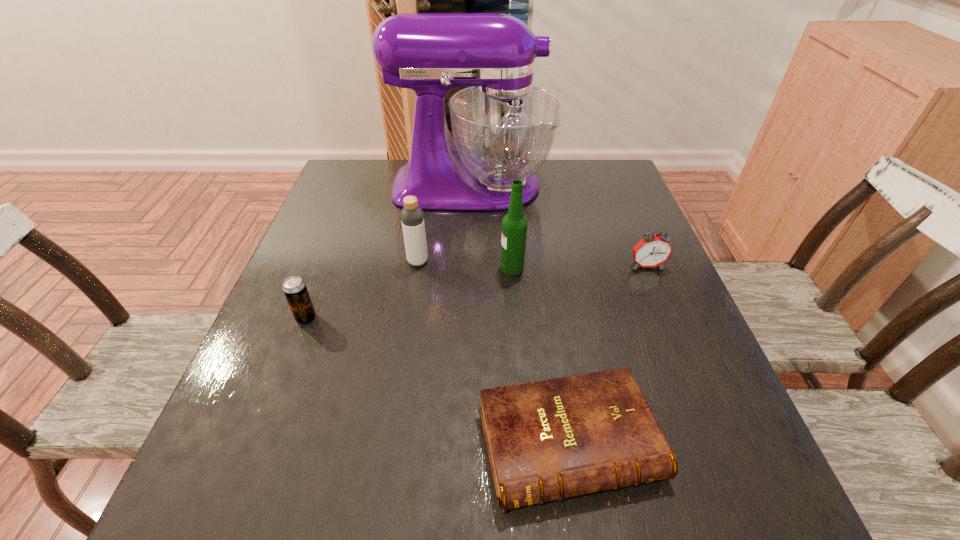
The width and height of the screenshot is (960, 540). Identify the location of vacant space that satisfies the following two spatial constraints: 1. at the bowl opening of the mixer; 2. on the left side of the shortest object. (466, 443).

The image size is (960, 540). In order to click on vacant space that satisfies the following two spatial constraints: 1. at the bowl opening of the shortest object; 2. on the left side of the farthest object in this screenshot , I will do `click(466, 443)`.

Where is `free spot that satisfies the following two spatial constraints: 1. on the front side of the shortest object; 2. on the left side of the third tallest object`? free spot that satisfies the following two spatial constraints: 1. on the front side of the shortest object; 2. on the left side of the third tallest object is located at coordinates (390, 443).

Where is `vacant region that satisfies the following two spatial constraints: 1. on the label of the beer bottle; 2. on the front side of the beer can`? vacant region that satisfies the following two spatial constraints: 1. on the label of the beer bottle; 2. on the front side of the beer can is located at coordinates (516, 318).

I want to click on free space in the image that satisfies the following two spatial constraints: 1. on the front side of the shortest object; 2. on the right side of the fourth shortest object, so click(x=390, y=443).